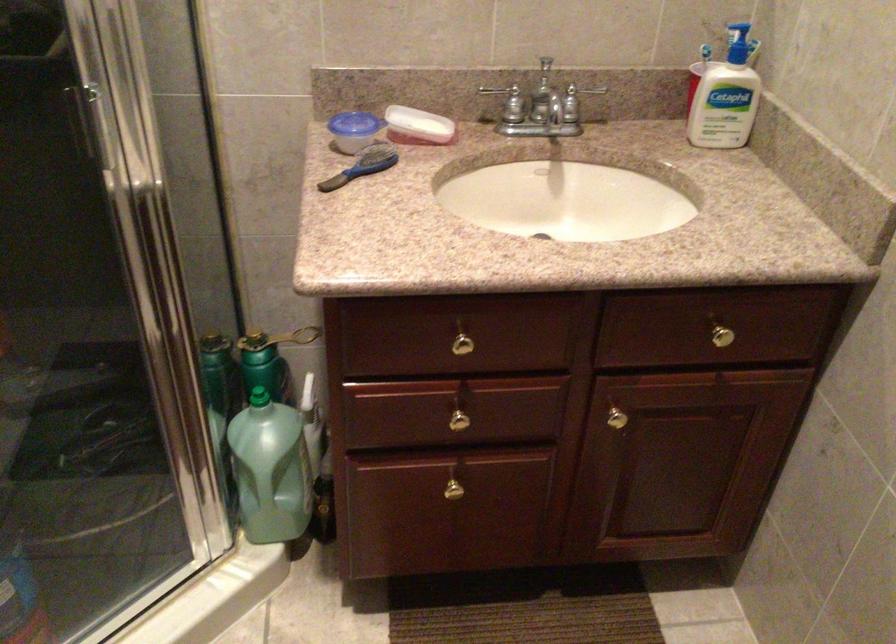
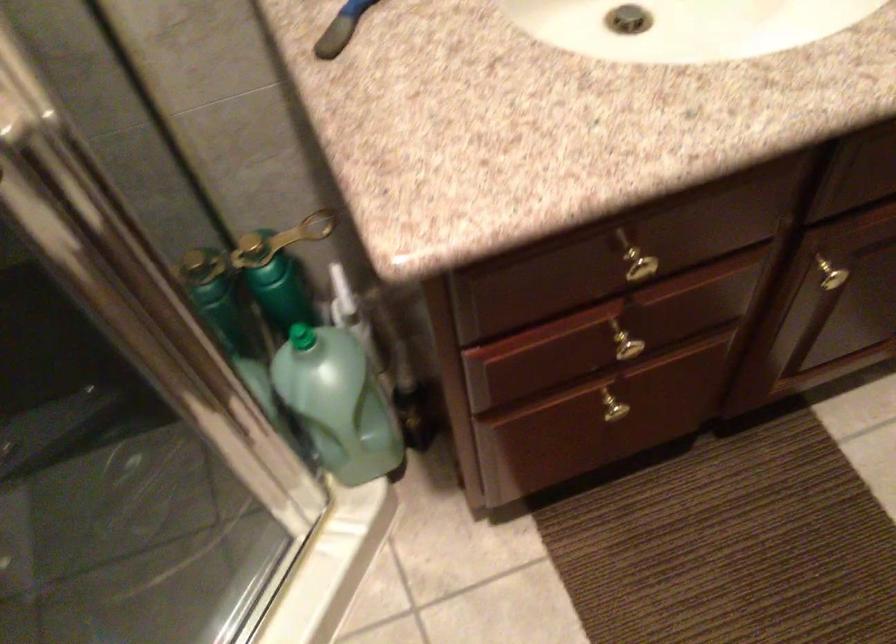
In the second image, find the point that corresponds to (257,397) in the first image.

(300, 337)